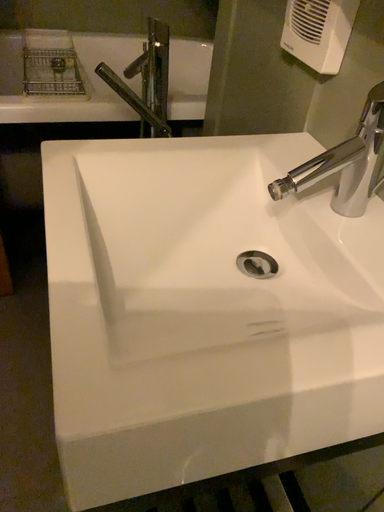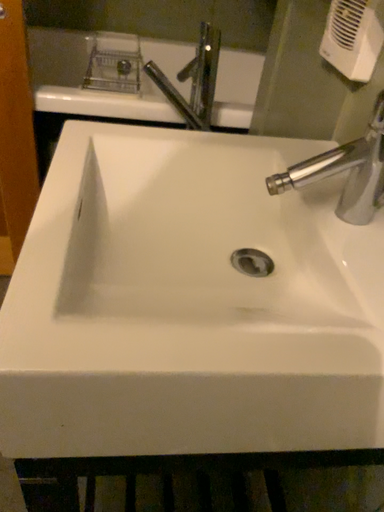
Question: Which way did the camera rotate in the video?

Choices:
 (A) rotated right
 (B) rotated left

Answer: (B)